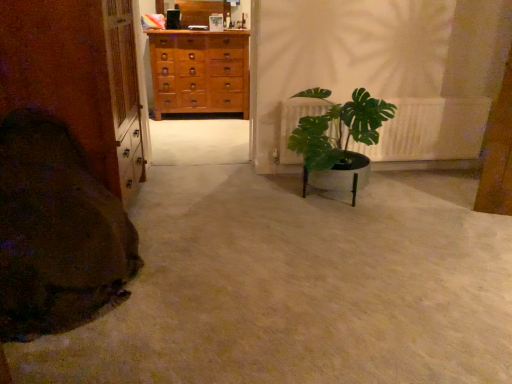
Describe the element at coordinates (199, 71) in the screenshot. I see `light brown wooden chest of drawers at center` at that location.

Measure the distance between brown soft blanket at lower left and camera.

The distance of brown soft blanket at lower left from camera is 1.80 meters.

Locate an element on the screen. green leafy plant at center is located at coordinates (338, 140).

Where is `green leafy plant at right`? Image resolution: width=512 pixels, height=384 pixels. green leafy plant at right is located at coordinates (430, 130).

Is green leafy plant at center turned away from brown soft blanket at lower left?

No, green leafy plant at center is not facing away from brown soft blanket at lower left.

From the image's perspective, which one is positioned higher, green leafy plant at center or brown soft blanket at lower left?

green leafy plant at center appears higher in the image.

Between point (349, 111) and point (68, 319), which one is positioned behind?

The point (349, 111) is farther.

Locate an element on the screen. The height and width of the screenshot is (384, 512). blanket below the light brown wooden chest of drawers at center (from the image's perspective) is located at coordinates (56, 232).

Which point is more distant from viewer, (222, 57) or (91, 212)?

The point (222, 57) is farther from the camera.

Which of these two, light brown wooden chest of drawers at center or brown soft blanket at lower left, is smaller?

brown soft blanket at lower left is smaller.

From a real-world perspective, is light brown wooden chest of drawers at center physically below brown soft blanket at lower left?

Incorrect, from a real-world perspective, light brown wooden chest of drawers at center is higher than brown soft blanket at lower left.

From a real-world perspective, is green leafy plant at right above or below light brown wooden chest of drawers at center?

In terms of real-world spatial position, green leafy plant at right is below light brown wooden chest of drawers at center.

Are green leafy plant at right and light brown wooden chest of drawers at center making contact?

No, green leafy plant at right is not with light brown wooden chest of drawers at center.

Is point (314, 109) closer or farther from the camera than point (180, 32)?

Point (314, 109) is positioned closer to the camera compared to point (180, 32).

Can you confirm if green leafy plant at right is taller than light brown wooden chest of drawers at center?

No.

Does point (17, 267) appear closer or farther from the camera than point (312, 185)?

Point (17, 267) appears to be closer to the viewer than point (312, 185).

Can you confirm if brown soft blanket at lower left is smaller than green leafy plant at center?

Actually, brown soft blanket at lower left might be larger than green leafy plant at center.

Is brown soft blanket at lower left to the right of green leafy plant at center from the viewer's perspective?

In fact, brown soft blanket at lower left is to the left of green leafy plant at center.

Is green leafy plant at center situated inside light brown wooden chest of drawers at center or outside?

The correct answer is: outside.

The width and height of the screenshot is (512, 384). There is a green leafy plant at center. Find the location of `the chest of drawers above it (from a real-world perspective)`. the chest of drawers above it (from a real-world perspective) is located at coordinates (199, 71).

How many degrees apart are the facing directions of green leafy plant at right and green leafy plant at center?

The facing directions of green leafy plant at right and green leafy plant at center are 0.748 degrees apart.

Is green leafy plant at right far from green leafy plant at center?

green leafy plant at right is near green leafy plant at center, not far away.

From a real-world perspective, between green leafy plant at right and green leafy plant at center, who is vertically higher?

In real-world perspective, green leafy plant at center is above.

Does point (291, 158) appear closer or farther from the camera than point (317, 147)?

Point (291, 158) is positioned farther from the camera compared to point (317, 147).

Does point (404, 126) lie behind point (46, 328)?

Yes, point (404, 126) is farther from viewer.

Consider the image. Is green leafy plant at right oriented towards brown soft blanket at lower left?

No, green leafy plant at right is not turned towards brown soft blanket at lower left.

How many degrees apart are the facing directions of green leafy plant at right and brown soft blanket at lower left?

The facing directions of green leafy plant at right and brown soft blanket at lower left are 0.132 degrees apart.

This screenshot has width=512, height=384. In order to click on radiator below the brown soft blanket at lower left (from a real-world perspective) in this screenshot , I will do `click(430, 130)`.

This screenshot has height=384, width=512. Find the location of `blanket in front of the green leafy plant at center`. blanket in front of the green leafy plant at center is located at coordinates (56, 232).

The image size is (512, 384). In order to click on blanket beneath the light brown wooden chest of drawers at center (from a real-world perspective) in this screenshot , I will do `click(56, 232)`.

Looking at the image, which one is located closer to light brown wooden chest of drawers at center, green leafy plant at center or green leafy plant at right?

green leafy plant at right is positioned closer to the anchor light brown wooden chest of drawers at center.

Looking at the image, which one is located closer to light brown wooden chest of drawers at center, green leafy plant at center or brown soft blanket at lower left?

The object closer to light brown wooden chest of drawers at center is green leafy plant at center.

From the picture: When comparing their distances from green leafy plant at center, does brown soft blanket at lower left or light brown wooden chest of drawers at center seem further?

light brown wooden chest of drawers at center.

Considering their positions, is light brown wooden chest of drawers at center positioned closer to green leafy plant at right than green leafy plant at center?

Among the two, green leafy plant at center is located nearer to green leafy plant at right.

Considering their positions, is green leafy plant at center positioned further to brown soft blanket at lower left than green leafy plant at right?

green leafy plant at right is further to brown soft blanket at lower left.

Which object lies further to the anchor point green leafy plant at right, brown soft blanket at lower left or green leafy plant at center?

The object further to green leafy plant at right is brown soft blanket at lower left.

When comparing their distances from green leafy plant at right, does green leafy plant at center or brown soft blanket at lower left seem closer?

green leafy plant at center is closer to green leafy plant at right.

From the image, which object appears to be farther from green leafy plant at center, green leafy plant at right or light brown wooden chest of drawers at center?

light brown wooden chest of drawers at center is positioned further to the anchor green leafy plant at center.

The image size is (512, 384). In order to click on radiator between brown soft blanket at lower left and light brown wooden chest of drawers at center along the z-axis in this screenshot , I will do `click(430, 130)`.

Locate an element on the screen. The width and height of the screenshot is (512, 384). radiator located between green leafy plant at center and light brown wooden chest of drawers at center in the depth direction is located at coordinates (430, 130).

Locate an element on the screen. The height and width of the screenshot is (384, 512). houseplant located between brown soft blanket at lower left and green leafy plant at right in the left-right direction is located at coordinates (338, 140).

Where is `houseplant between brown soft blanket at lower left and light brown wooden chest of drawers at center from front to back`? The image size is (512, 384). houseplant between brown soft blanket at lower left and light brown wooden chest of drawers at center from front to back is located at coordinates (338, 140).